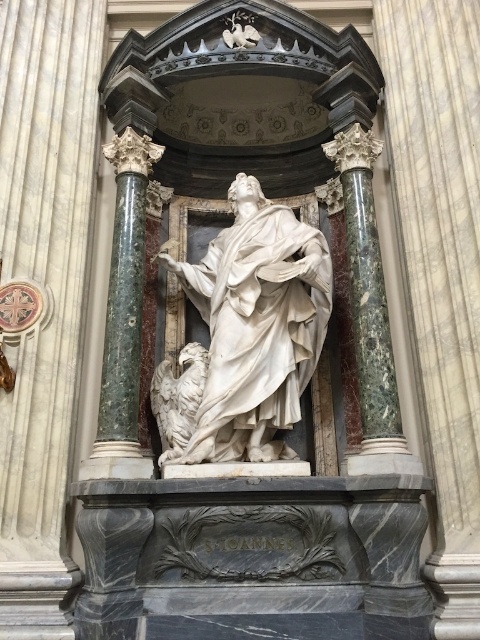
Question: Which point is closer to the camera?

Choices:
 (A) green marble column at left
 (B) white marble eagle at lower left
 (C) green marble column at right

Answer: (C)

Question: Does white marble statue at center lie in front of green marble column at right?

Choices:
 (A) no
 (B) yes

Answer: (A)

Question: Is white marble statue at center to the right of green marble column at left from the viewer's perspective?

Choices:
 (A) no
 (B) yes

Answer: (B)

Question: Which object is closer to the camera taking this photo?

Choices:
 (A) white marble eagle at lower left
 (B) green marble column at left
 (C) white marble statue at center
 (D) green marble column at right

Answer: (D)

Question: Can you confirm if green marble column at left is positioned below white marble eagle at lower left?

Choices:
 (A) yes
 (B) no

Answer: (B)

Question: Which point is farther to the camera?

Choices:
 (A) (165, 445)
 (B) (308, 348)
 (C) (144, 253)

Answer: (C)